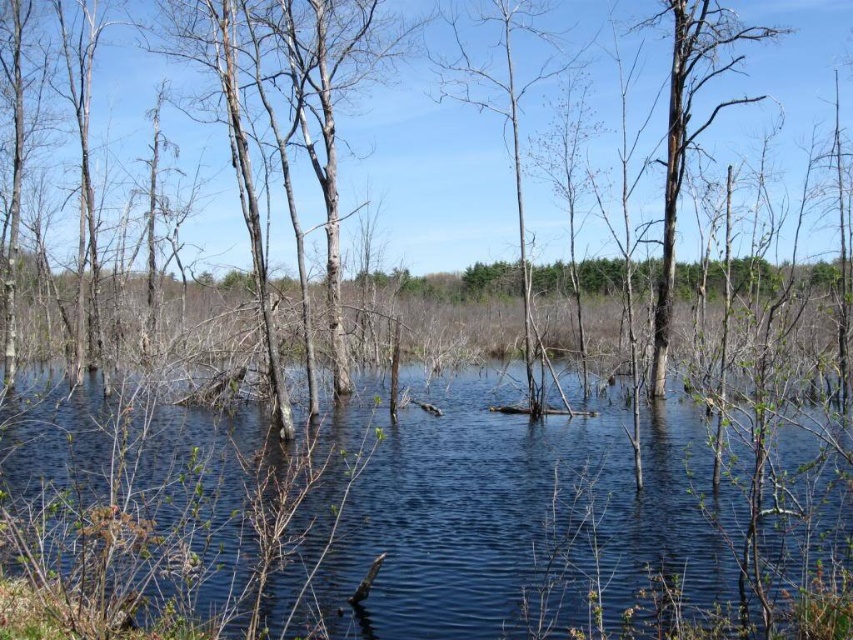
You are standing at the edge of the wetland and want to cross to the other side. The clear water at center is in your way. Is there a path around it on the left or right side?

The clear water at center is located at point (x=519, y=513), so there is no path around it on either side as it is centrally positioned.

You are a bird flying over the wetland scene. You spot two points in the image. The first point is at coordinate point (526, 522) and the second is at point (440, 67). Which point is closer to you as you fly overhead?

Point (526, 522) is in front of point (440, 67), so the first point is closer to you as you fly overhead.